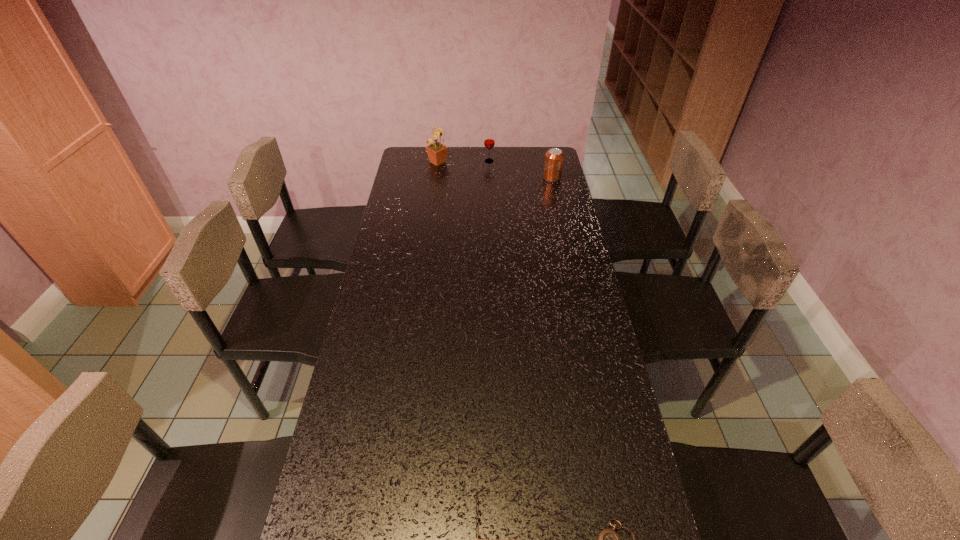
Locate an element on the screen. This screenshot has height=540, width=960. vacant space that is in between the third farthest object and the sunflower is located at coordinates (494, 170).

Identify the location of unoccupied area between the can and the leftmost object. This screenshot has width=960, height=540. (494, 170).

Select which object appears as the second closest to the fourth tallest object. Please provide its 2D coordinates. Your answer should be formatted as a tuple, i.e. [(x, y)], where the tuple contains the x and y coordinates of a point satisfying the conditions above.

[(554, 157)]

Locate which object is the third closest to the third nearest object. Please provide its 2D coordinates. Your answer should be formatted as a tuple, i.e. [(x, y)], where the tuple contains the x and y coordinates of a point satisfying the conditions above.

[(479, 520)]

At what (x,y) coordinates should I click in order to perform the action: click on free location that satisfies the following two spatial constraints: 1. at the front of the leftmost object with flowers visible; 2. on the back side of the third nearest object. Please return your answer as a coordinate pair (x, y). The height and width of the screenshot is (540, 960). Looking at the image, I should click on (436, 178).

Identify the location of vacant space that satisfies the following two spatial constraints: 1. at the front of the can with flowers visible; 2. on the left side of the tallest object. Image resolution: width=960 pixels, height=540 pixels. (436, 178).

I want to click on vacant space that satisfies the following two spatial constraints: 1. at the front of the tallest object with flowers visible; 2. on the left side of the third nearest object, so click(436, 178).